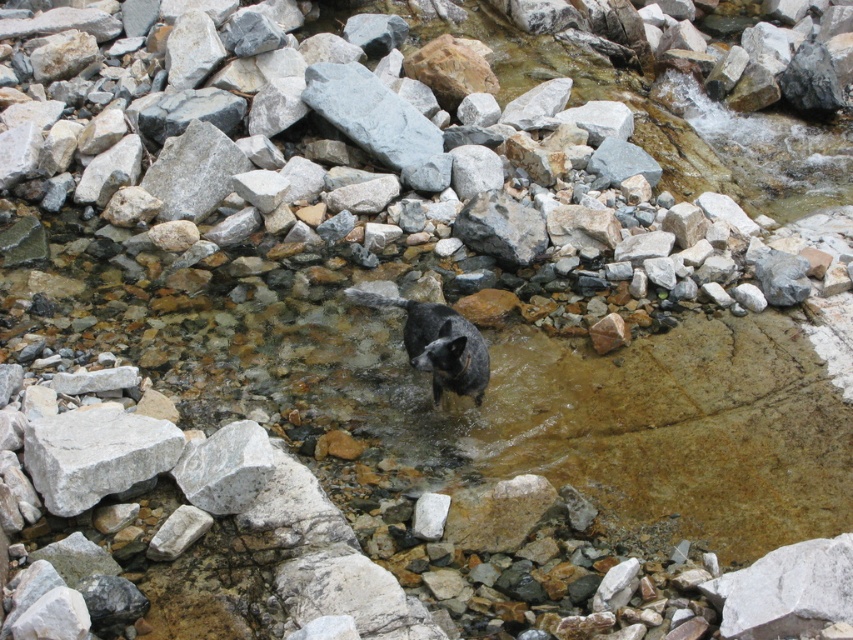
Is point (76, 420) less distant than point (363, 118)?

Yes, it is in front of point (363, 118).

Where is `gray/rough rock at lower left`? This screenshot has width=853, height=640. gray/rough rock at lower left is located at coordinates (96, 454).

At what (x,y) coordinates should I click in order to perform the action: click on gray/rough rock at lower left. Please return your answer as a coordinate pair (x, y). The image size is (853, 640). Looking at the image, I should click on (96, 454).

In the scene shown: Is gray/rough rock at lower left smaller than shiny black fur cat at center?

Correct, gray/rough rock at lower left occupies less space than shiny black fur cat at center.

How much distance is there between gray/rough rock at lower left and shiny black fur cat at center?

A distance of 1.41 meters exists between gray/rough rock at lower left and shiny black fur cat at center.

Is point (62, 508) less distant than point (439, 374)?

Yes.

Identify the location of gray/rough rock at lower left. This screenshot has height=640, width=853. (96, 454).

The height and width of the screenshot is (640, 853). Describe the element at coordinates (379, 122) in the screenshot. I see `gray smooth rock at center` at that location.

Between gray smooth rock at center and shiny black fur cat at center, which one has more height?

gray smooth rock at center

Between point (419, 148) and point (408, 314), which one is positioned behind?

Point (419, 148)

Where is `gray smooth rock at center`? gray smooth rock at center is located at coordinates (379, 122).